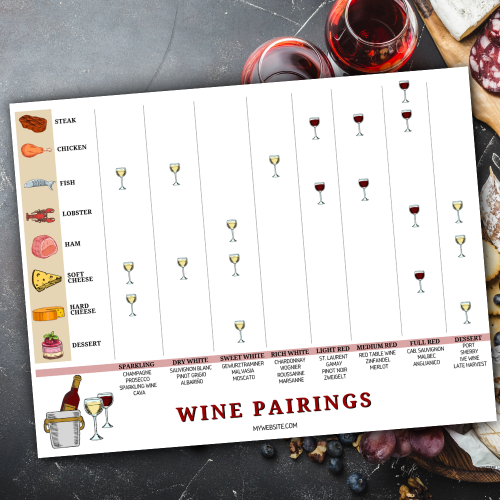
Identify the location of table. The height and width of the screenshot is (500, 500). (153, 48).